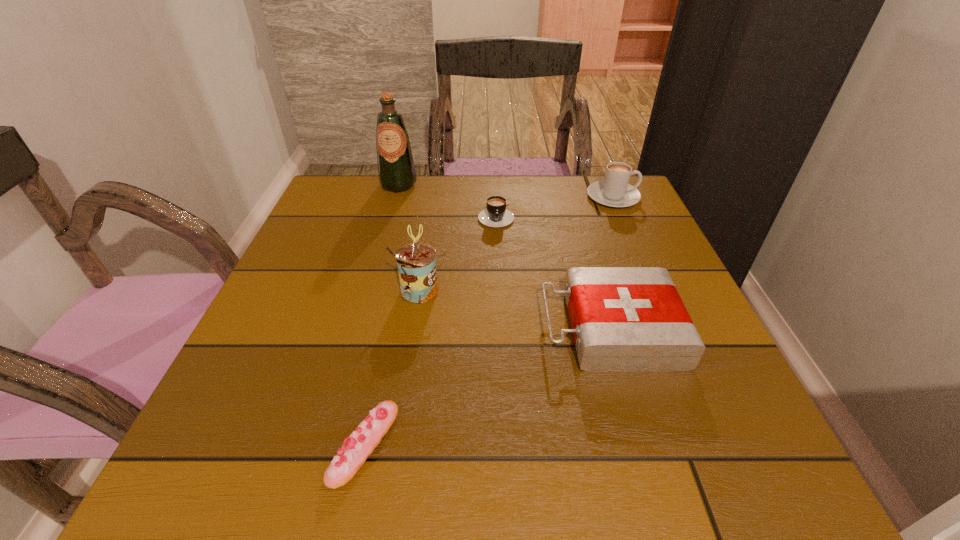
Where is `vacant area situated on the front of the can`? Image resolution: width=960 pixels, height=540 pixels. vacant area situated on the front of the can is located at coordinates (391, 475).

Identify the location of free location located 0.390m on the front side of the first-aid kit. (327, 329).

Where is `blank area located on the front side of the first-aid kit`? blank area located on the front side of the first-aid kit is located at coordinates pyautogui.click(x=405, y=329).

This screenshot has width=960, height=540. I want to click on free spot located on the front side of the first-aid kit, so tap(349, 329).

Where is `free region located 0.080m with the handle on the side of the fourth object from left to right`? The width and height of the screenshot is (960, 540). free region located 0.080m with the handle on the side of the fourth object from left to right is located at coordinates (497, 250).

Identify the location of free space located 0.270m on the back of the eclair. The height and width of the screenshot is (540, 960). (397, 286).

The image size is (960, 540). In order to click on olive oil at the far edge in this screenshot , I will do `click(396, 171)`.

Find the location of `object situated at the near edge`. object situated at the near edge is located at coordinates (356, 448).

The width and height of the screenshot is (960, 540). In order to click on object that is positioned at the left edge in this screenshot , I will do `click(396, 171)`.

Where is `cappuccino that is at the right edge`? The image size is (960, 540). cappuccino that is at the right edge is located at coordinates (614, 191).